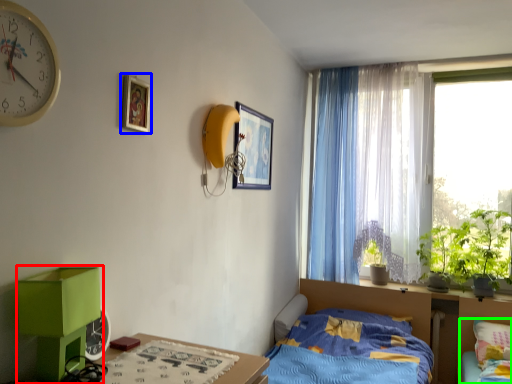
Question: Based on their relative distances, which object is farther from changing table (highlighted by a red box)? Choose from picture frame (highlighted by a blue box) and bed (highlighted by a green box).

Choices:
 (A) picture frame
 (B) bed

Answer: (B)